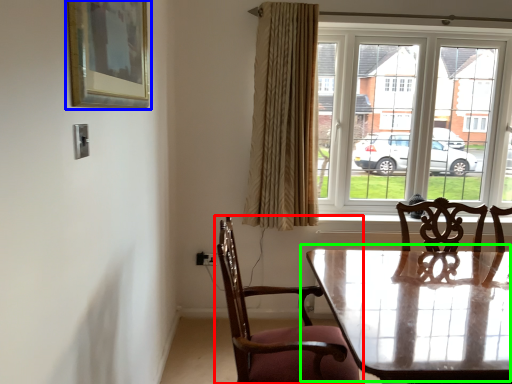
Question: Which object is positioned farthest from chair (highlighted by a red box)? Select from picture frame (highlighted by a blue box) and table (highlighted by a green box).

Choices:
 (A) picture frame
 (B) table

Answer: (A)